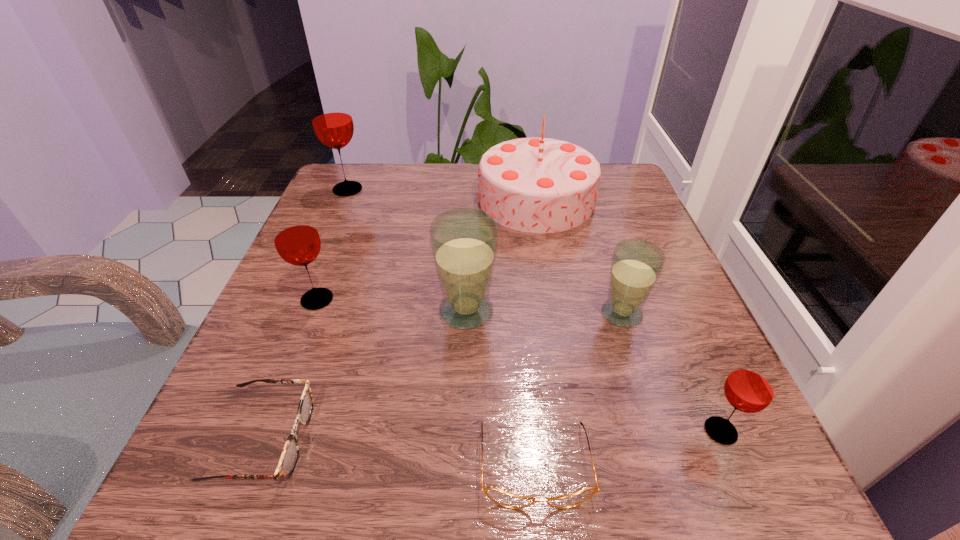
The height and width of the screenshot is (540, 960). What are the coordinates of `birthday cake positioned at the far edge` in the screenshot? It's located at (541, 185).

The image size is (960, 540). What are the coordinates of `glass situated at the near edge` in the screenshot? It's located at (751, 386).

The height and width of the screenshot is (540, 960). I want to click on spectacles that is at the left edge, so click(x=290, y=453).

The image size is (960, 540). Find the location of `birthday cake located at the right edge`. birthday cake located at the right edge is located at coordinates (541, 185).

This screenshot has width=960, height=540. I want to click on object that is at the far left corner, so click(331, 117).

The height and width of the screenshot is (540, 960). In order to click on object that is positioned at the near left corner in this screenshot , I will do `click(290, 453)`.

I want to click on object at the far right corner, so click(x=541, y=185).

The height and width of the screenshot is (540, 960). What are the coordinates of `object present at the near right corner` in the screenshot? It's located at (751, 386).

Image resolution: width=960 pixels, height=540 pixels. Identify the location of vacant region at the far edge of the desktop. (437, 208).

Image resolution: width=960 pixels, height=540 pixels. Find the location of `free space at the near edge`. free space at the near edge is located at coordinates (564, 513).